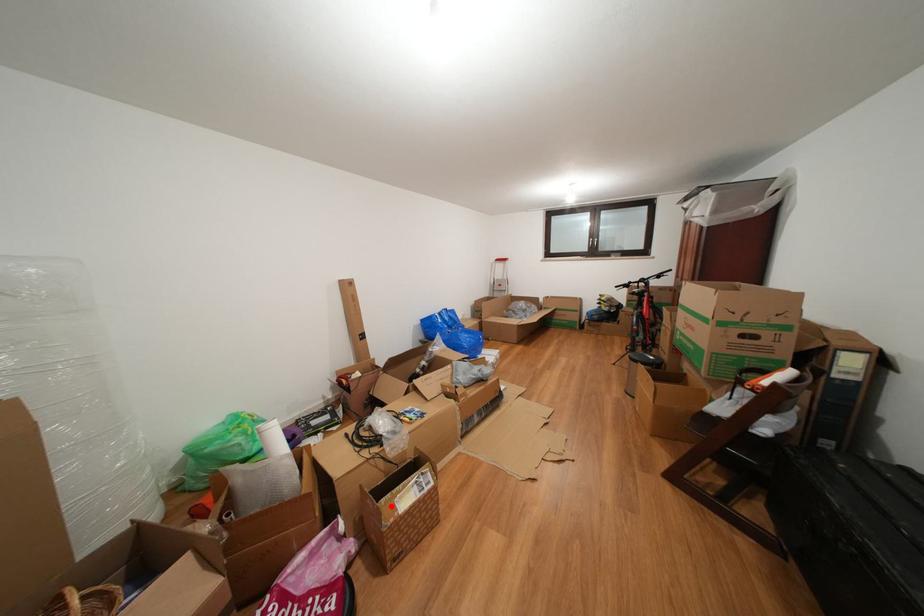
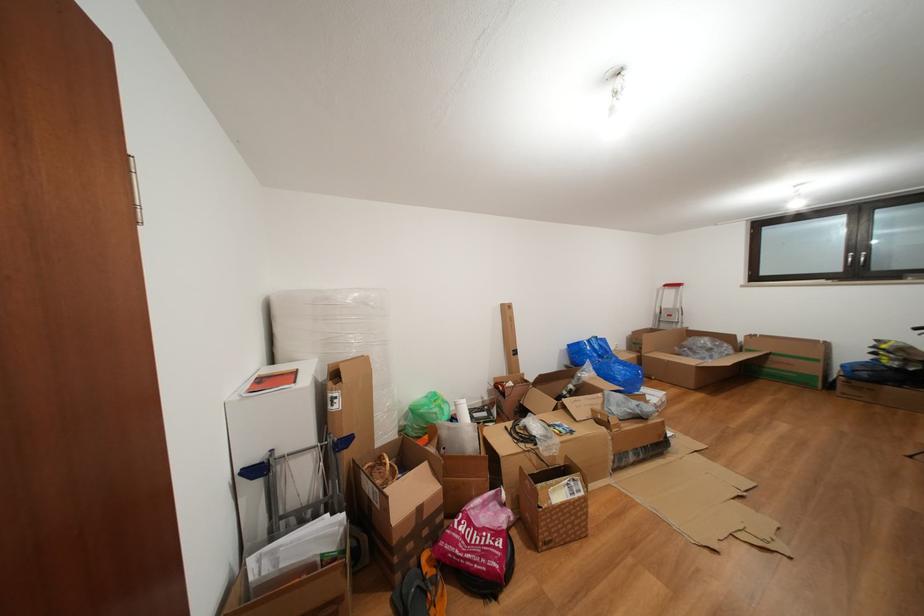
The point at the highlighted location is marked in the first image. Where is the corresponding point in the second image?

(546, 491)